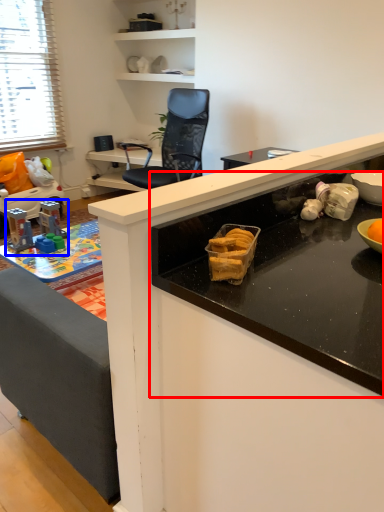
Question: Which object appears closest to the camera in this image, countertop (highlighted by a red box) or toy (highlighted by a blue box)?

Choices:
 (A) countertop
 (B) toy

Answer: (A)